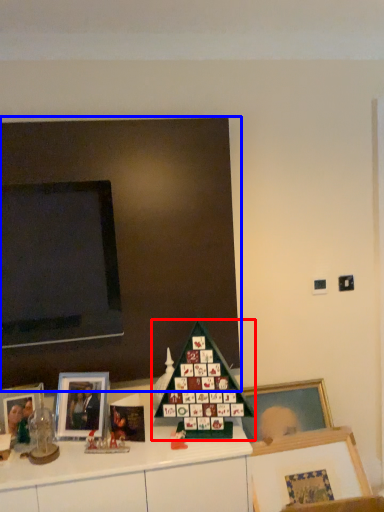
Question: Which point is closer to the camera, christmas tree (highlighted by a red box) or bulletin board (highlighted by a blue box)?

Choices:
 (A) christmas tree
 (B) bulletin board

Answer: (A)